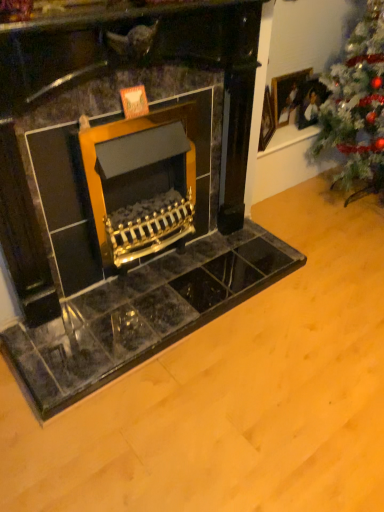
Question: Should I look upward or downward to see wooden picture frame at upper right?

Choices:
 (A) down
 (B) up

Answer: (B)

Question: Does wooden picture frame at upper right come in front of green textured christmas tree at right?

Choices:
 (A) no
 (B) yes

Answer: (A)

Question: From the image's perspective, is wooden picture frame at upper right under green textured christmas tree at right?

Choices:
 (A) no
 (B) yes

Answer: (A)

Question: Would you say wooden picture frame at upper right contains green textured christmas tree at right?

Choices:
 (A) no
 (B) yes

Answer: (A)

Question: From a real-world perspective, is wooden picture frame at upper right physically below green textured christmas tree at right?

Choices:
 (A) no
 (B) yes

Answer: (B)

Question: From a real-world perspective, is wooden picture frame at upper right located higher than green textured christmas tree at right?

Choices:
 (A) no
 (B) yes

Answer: (A)

Question: Does wooden picture frame at upper right appear on the left side of green textured christmas tree at right?

Choices:
 (A) yes
 (B) no

Answer: (A)

Question: Does green textured christmas tree at right appear on the right side of wooden picture frame at upper right?

Choices:
 (A) yes
 (B) no

Answer: (A)

Question: From a real-world perspective, is green textured christmas tree at right on wooden picture frame at upper right?

Choices:
 (A) no
 (B) yes

Answer: (B)

Question: Does green textured christmas tree at right have a smaller size compared to wooden picture frame at upper right?

Choices:
 (A) yes
 (B) no

Answer: (B)

Question: Is green textured christmas tree at right behind wooden picture frame at upper right?

Choices:
 (A) yes
 (B) no

Answer: (B)

Question: From the image's perspective, is green textured christmas tree at right over wooden picture frame at upper right?

Choices:
 (A) no
 (B) yes

Answer: (A)

Question: Is green textured christmas tree at right to the left of wooden picture frame at upper right from the viewer's perspective?

Choices:
 (A) yes
 (B) no

Answer: (B)

Question: In terms of height, does wooden picture frame at upper right look taller or shorter compared to green textured christmas tree at right?

Choices:
 (A) tall
 (B) short

Answer: (B)